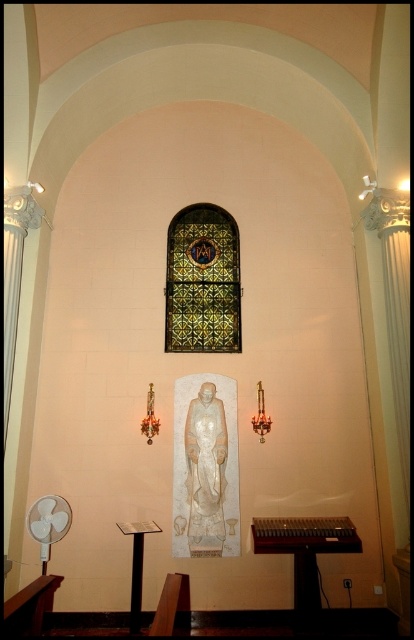
Question: Which point is closer to the camera?

Choices:
 (A) green stained glass at center
 (B) wooden table at lower center

Answer: (B)

Question: Is green stained glass at center smaller than wooden table at lower center?

Choices:
 (A) no
 (B) yes

Answer: (A)

Question: Which point appears closest to the camera in this image?

Choices:
 (A) (202, 224)
 (B) (262, 518)

Answer: (B)

Question: Is green stained glass at center thinner than wooden table at lower center?

Choices:
 (A) no
 (B) yes

Answer: (B)

Question: Does green stained glass at center have a smaller size compared to wooden table at lower center?

Choices:
 (A) yes
 (B) no

Answer: (B)